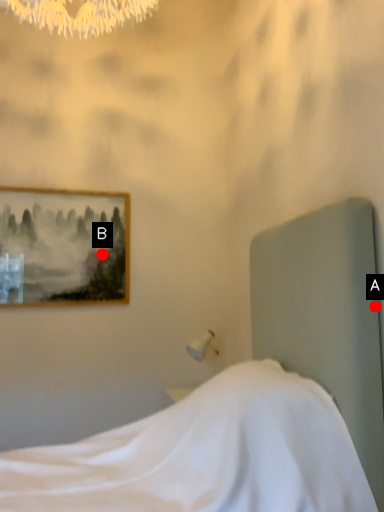
Question: Two points are circled on the image, labeled by A and B beside each circle. Among these points, which one is farthest from the camera?

Choices:
 (A) A is further
 (B) B is further

Answer: (B)